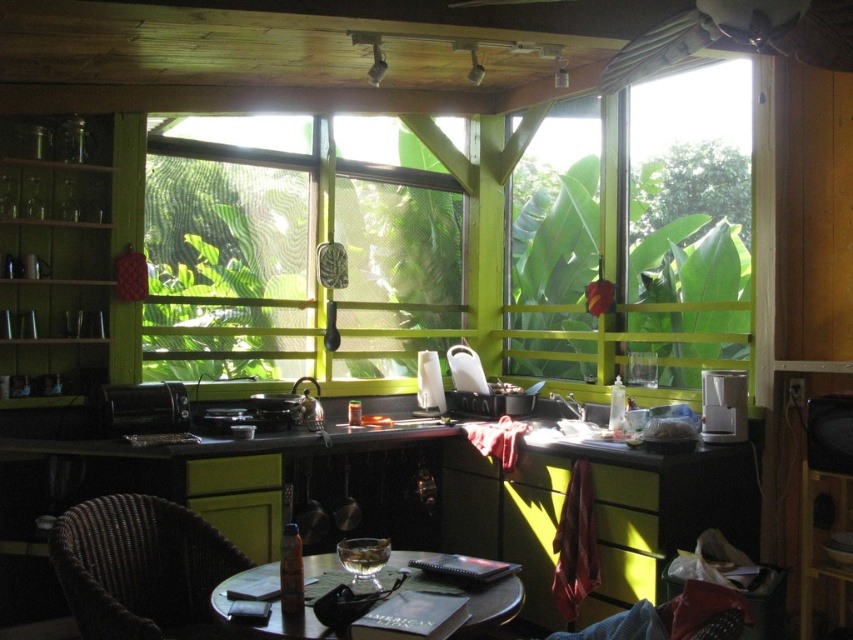
You are standing in the kitchen and want to see the tropical foliage outside. Where should you look to see the transparent glass window at upper right?

The transparent glass window at upper right is located at point (689,186), so you should look towards the upper right area of the kitchen to see it.

You are a painter who wants to hang a 10 cm wide painting on the wall between the green wooden window at center and the wooden round table at center. Which object should you choose to place the painting closer to, so that the painting doesn

The green wooden window at center is thinner than the wooden round table at center, so placing the painting closer to the green wooden window at center would allow it to fit better since the window is narrower.